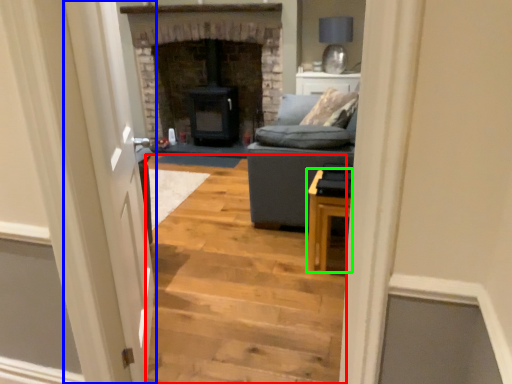
Question: Which object is positioned farthest from stairwell (highlighted by a red box)? Select from glass door (highlighted by a blue box) and table (highlighted by a green box).

Choices:
 (A) glass door
 (B) table

Answer: (A)